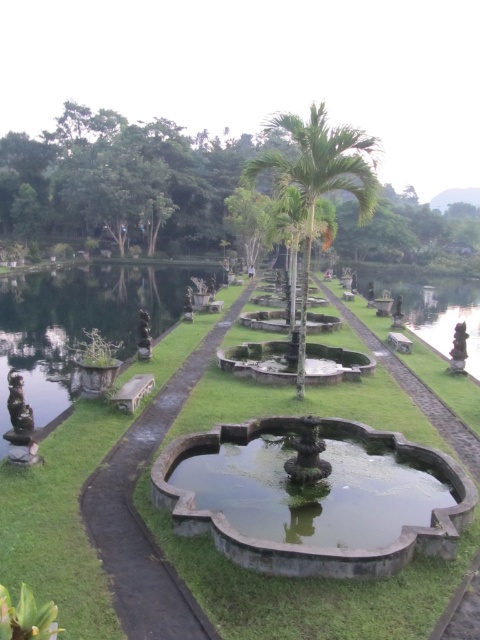
Question: Considering the relative positions of green leafy palm tree at upper left and green leafy palm tree at center in the image provided, where is green leafy palm tree at upper left located with respect to green leafy palm tree at center?

Choices:
 (A) below
 (B) above

Answer: (A)

Question: Estimate the real-world distances between objects in this image. Which object is farther from the green stone bench at left?

Choices:
 (A) dark gray stone path at center
 (B) green grass at center

Answer: (A)

Question: Is green leafy palm tree at upper left below green mossy stone fountain at center?

Choices:
 (A) yes
 (B) no

Answer: (B)

Question: Is green leafy palm tree at upper left below bronze statue at left?

Choices:
 (A) no
 (B) yes

Answer: (A)

Question: Which point appears farthest from the camera in this image?

Choices:
 (A) coord(64,280)
 (B) coord(309,209)
 (C) coord(28,464)

Answer: (A)

Question: Which is nearer to the green stone bench at left?

Choices:
 (A) green leafy palm tree at upper left
 (B) dark gray stone path at center

Answer: (A)